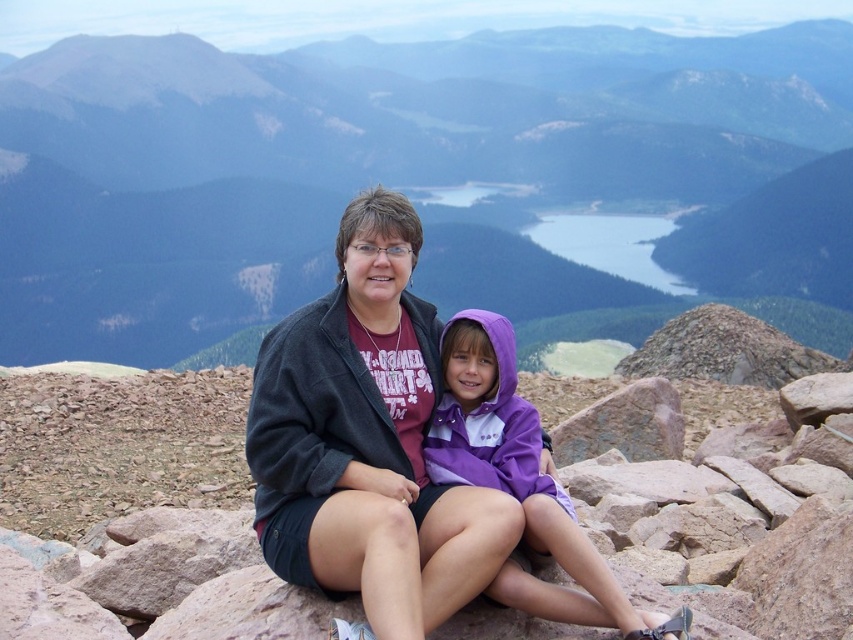
Between dark gray jacket at center and dark gray fleece sweatshirt at center, which one has more height?

dark gray jacket at center

Is dark gray jacket at center to the right of dark gray fleece sweatshirt at center from the viewer's perspective?

Indeed, dark gray jacket at center is positioned on the right side of dark gray fleece sweatshirt at center.

I want to click on dark gray jacket at center, so click(366, 442).

What do you see at coordinates (366, 442) in the screenshot? I see `dark gray jacket at center` at bounding box center [366, 442].

Who is more distant from viewer, (315, 332) or (500, 451)?

The point (315, 332) is more distant.

The height and width of the screenshot is (640, 853). Find the location of `dark gray jacket at center`. dark gray jacket at center is located at coordinates (366, 442).

What do you see at coordinates (519, 477) in the screenshot? I see `purple fleece jacket at center` at bounding box center [519, 477].

Between purple fleece jacket at center and dark gray fleece sweatshirt at center, which one has less height?

With less height is dark gray fleece sweatshirt at center.

Is point (492, 596) positioned before point (288, 326)?

Yes.

This screenshot has width=853, height=640. In order to click on purple fleece jacket at center in this screenshot , I will do `click(519, 477)`.